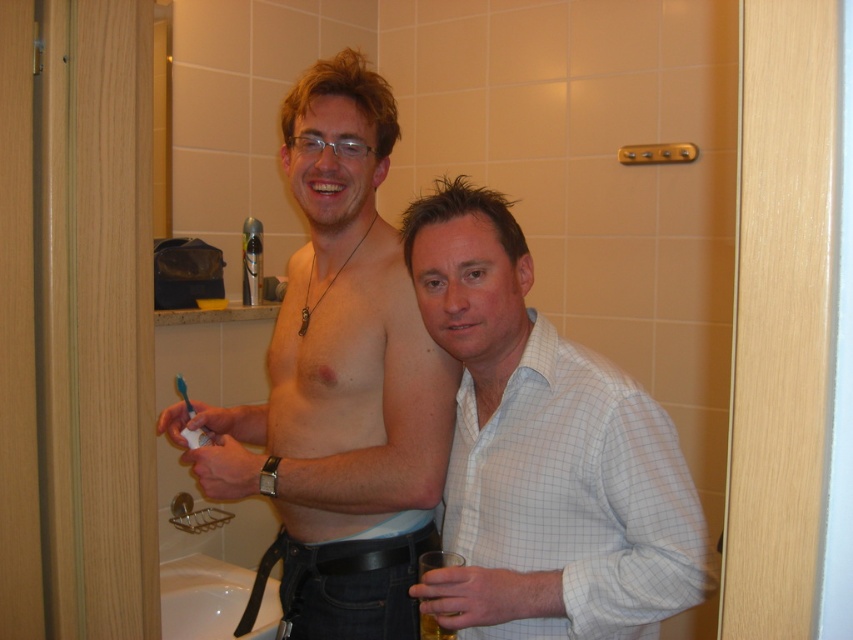
Between white glossy sink at lower left and blue plastic toothbrush at lower left, which one has more height?

With more height is white glossy sink at lower left.

This screenshot has height=640, width=853. Find the location of `white glossy sink at lower left`. white glossy sink at lower left is located at coordinates (202, 596).

Locate an element on the screen. The width and height of the screenshot is (853, 640). white glossy sink at lower left is located at coordinates (202, 596).

Does smooth skin torso at center have a larger size compared to white checkered shirt at center?

Yes, smooth skin torso at center is bigger than white checkered shirt at center.

Measure the distance between smooth skin torso at center and camera.

A distance of 1.21 meters exists between smooth skin torso at center and camera.

Which is in front, point (421, 333) or point (447, 490)?

Positioned in front is point (447, 490).

Locate an element on the screen. The image size is (853, 640). smooth skin torso at center is located at coordinates (339, 385).

Between point (657, 500) and point (178, 381), which one is positioned in front?

Point (657, 500)

Who is positioned more to the left, white checkered shirt at center or blue plastic toothbrush at lower left?

blue plastic toothbrush at lower left is more to the left.

Is point (457, 468) closer to viewer compared to point (184, 385)?

Yes, it is.

I want to click on white checkered shirt at center, so click(575, 496).